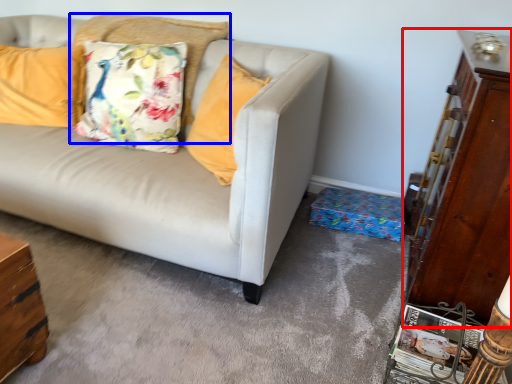
Question: Which point is further to the camera, dresser (highlighted by a red box) or pillow (highlighted by a blue box)?

Choices:
 (A) dresser
 (B) pillow

Answer: (B)